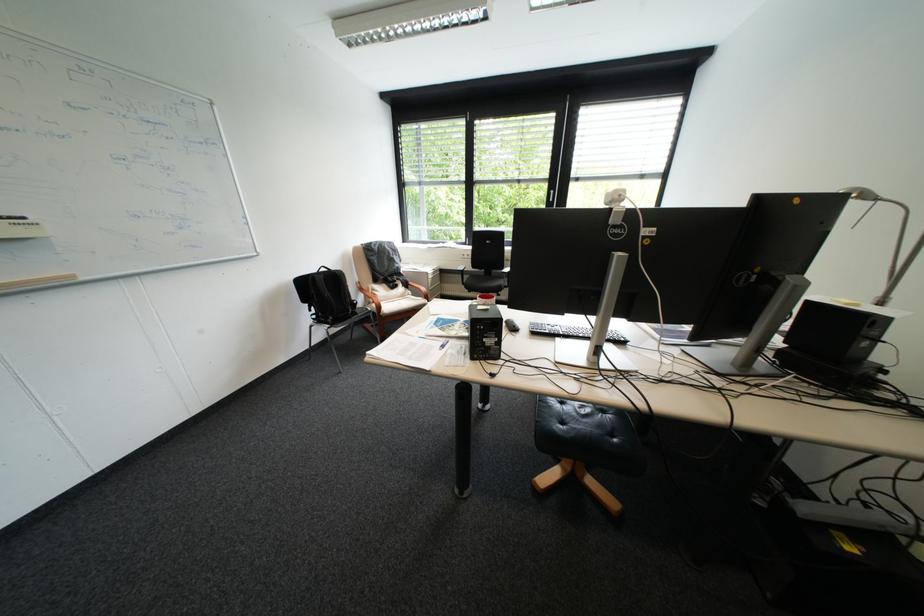
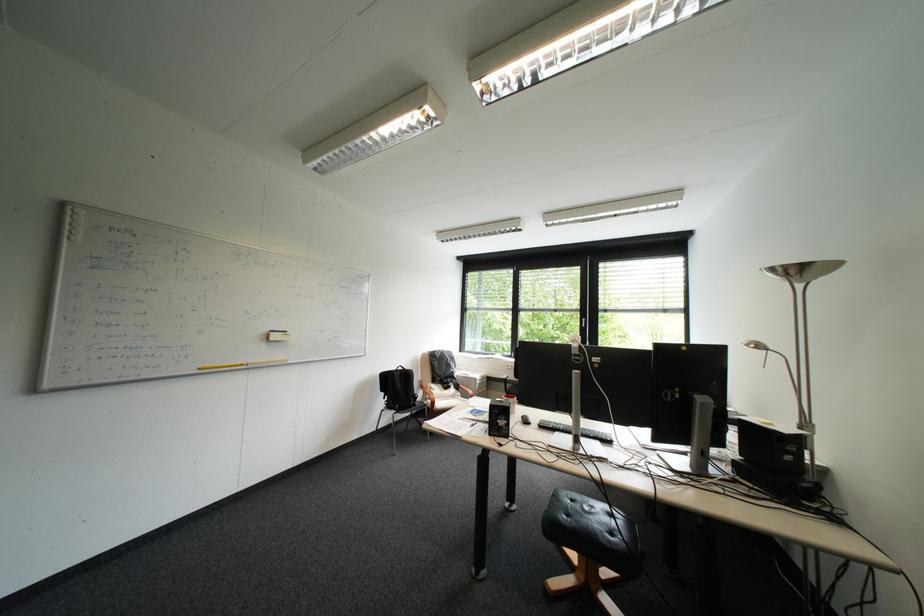
Question: In a continuous first-person perspective shot, in which direction is the camera moving?

Choices:
 (A) Left
 (B) Right
 (C) Forward
 (D) Backward

Answer: (D)